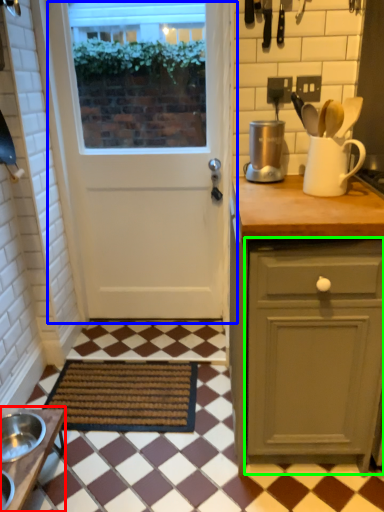
Question: Based on their relative distances, which object is farther from table (highlighted by a red box)? Choose from door (highlighted by a blue box) and cabinetry (highlighted by a green box).

Choices:
 (A) door
 (B) cabinetry

Answer: (A)